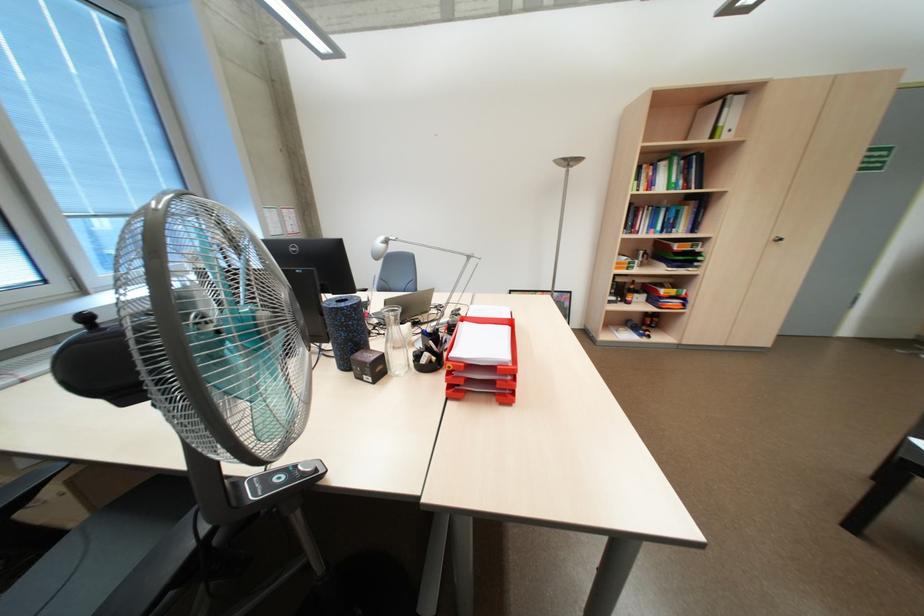
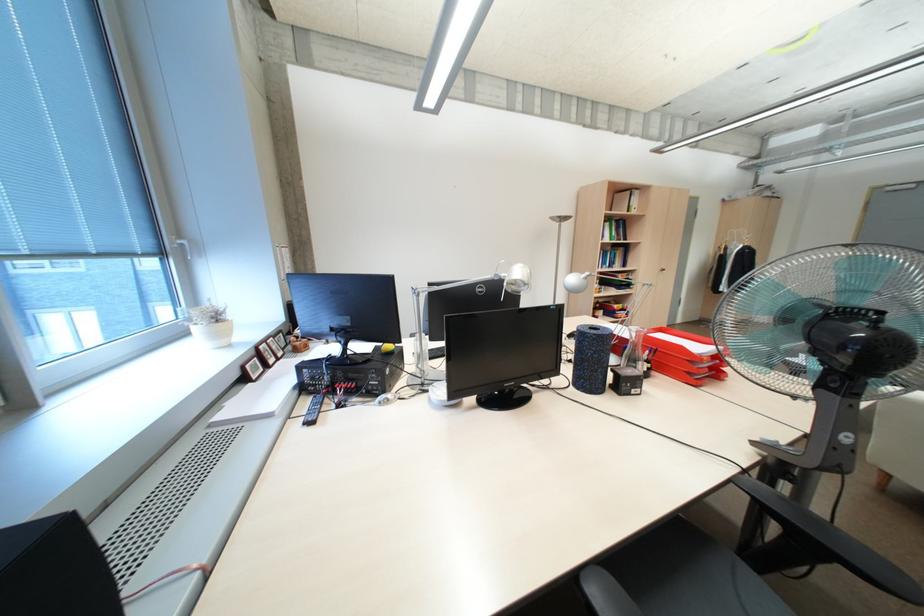
The point at (493, 397) is marked in the first image. Where is the corresponding point in the second image?

(716, 379)